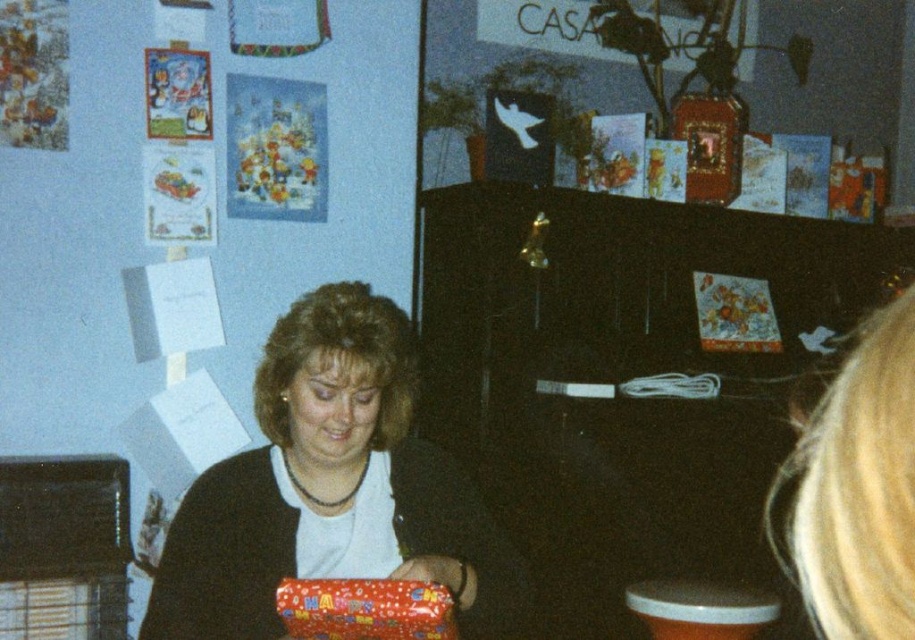
Question: Does shiny red wrapping paper at center have a larger size compared to shiny red wrapping paper at lower center?

Choices:
 (A) no
 (B) yes

Answer: (B)

Question: Which object is positioned farthest from the blonde hair at lower right?

Choices:
 (A) orange plastic stool at lower right
 (B) shiny red wrapping paper at lower center

Answer: (B)

Question: Does shiny red wrapping paper at center have a larger size compared to shiny red wrapping paper at lower center?

Choices:
 (A) no
 (B) yes

Answer: (B)

Question: Can you confirm if shiny red wrapping paper at center is positioned to the right of shiny red wrapping paper at lower center?

Choices:
 (A) yes
 (B) no

Answer: (B)

Question: Which object is positioned farthest from the orange plastic stool at lower right?

Choices:
 (A) shiny red wrapping paper at lower center
 (B) shiny red wrapping paper at center

Answer: (A)

Question: Which of the following is the closest to the observer?

Choices:
 (A) (821, 630)
 (B) (449, 612)

Answer: (B)